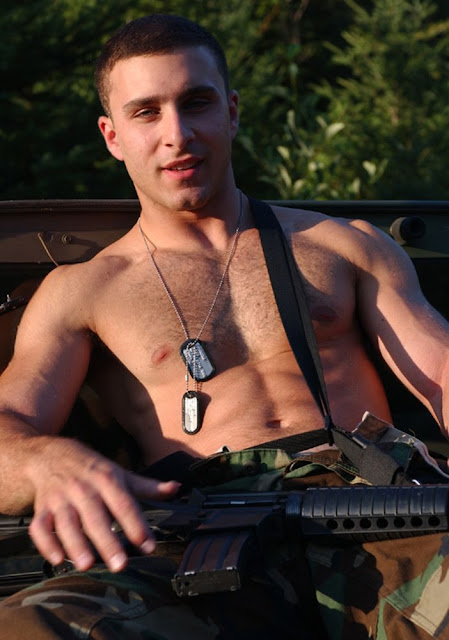
Where is `magazine`? magazine is located at coordinates (217, 552).